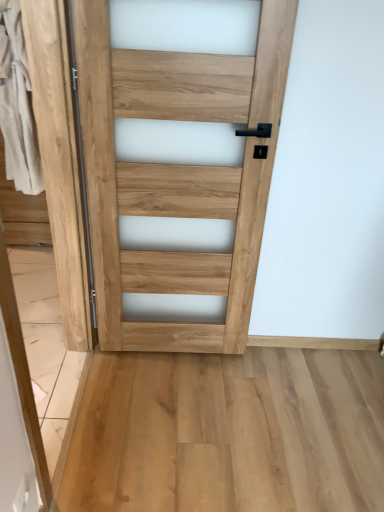
The image size is (384, 512). Find the location of `free point below natural wood barn door at center (from a real-world perspective)`. free point below natural wood barn door at center (from a real-world perspective) is located at coordinates (68, 406).